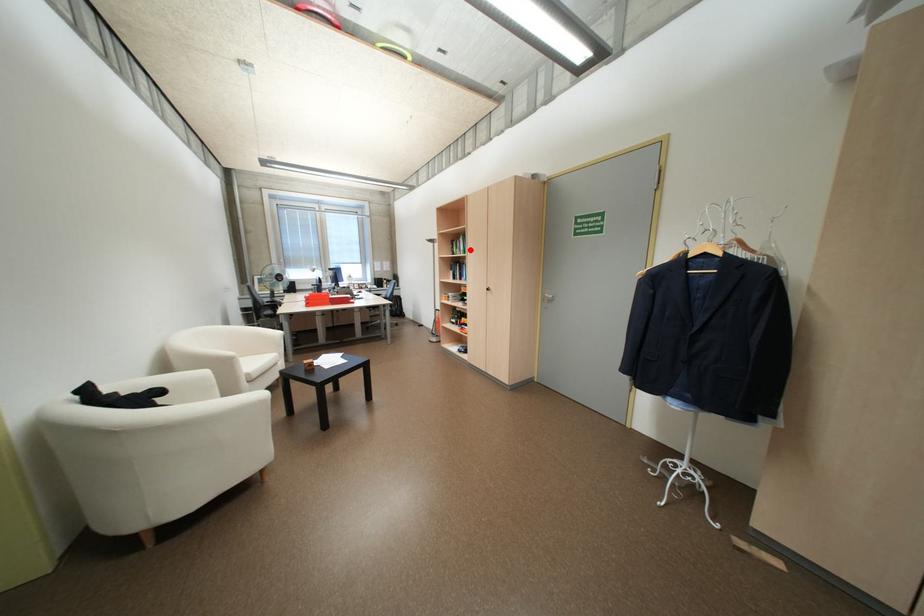
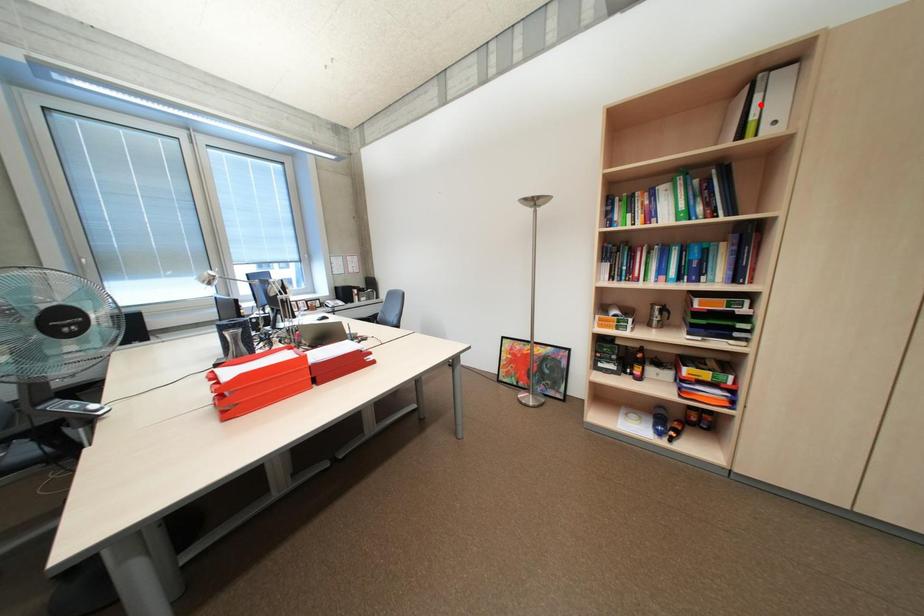
I am providing you with two images of the same scene from different viewpoints. A red point is marked on the first image and another point is marked on the second image. Does the point marked in image1 correspond to the same location as the one in image2?

No